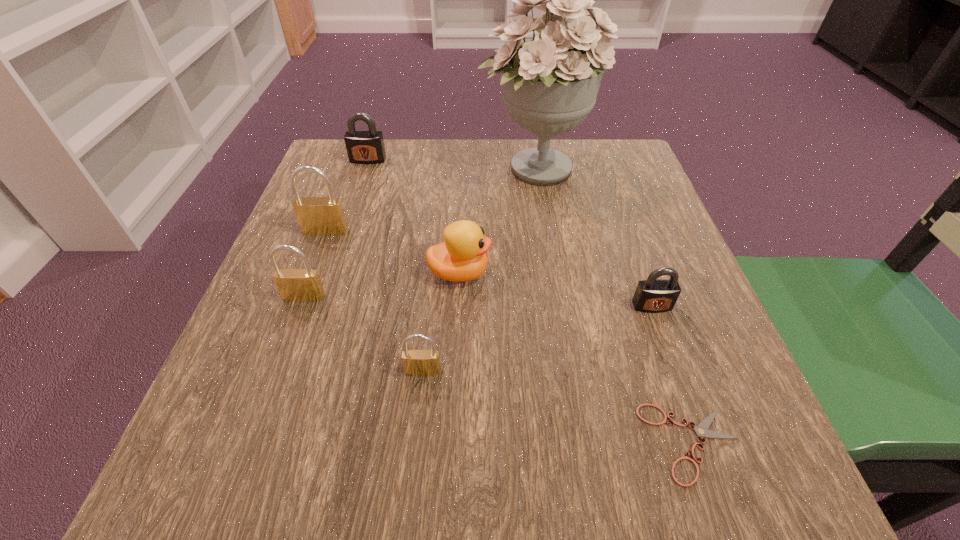
You are a GUI agent. You are given a task and a screenshot of the screen. Output one action in this format:
    pyautogui.click(x=<x>, y=<y>)
    Task: Click on the rightmost padlock
    
    Given the screenshot: What is the action you would take?
    pyautogui.click(x=653, y=295)

The image size is (960, 540). I want to click on the fourth padlock from left to right, so click(x=416, y=362).

Locate an element on the screen. the nearest brass padlock is located at coordinates (416, 362).

The image size is (960, 540). Find the location of `shears`. shears is located at coordinates (701, 430).

Where is `the shortest object`? The height and width of the screenshot is (540, 960). the shortest object is located at coordinates (701, 430).

At what (x,y) coordinates should I click in order to perform the action: click on free space located on the front of the bouquet. Please return your answer as a coordinate pair (x, y). This screenshot has height=540, width=960. Looking at the image, I should click on (554, 298).

The image size is (960, 540). Identify the location of free space located 0.320m on the front-facing side of the sixth nearest object. (271, 376).

The width and height of the screenshot is (960, 540). In order to click on free spot located on the front of the farther gray padlock near the keyhole in this screenshot , I will do `click(354, 202)`.

Where is `vacant space situated 0.300m on the front-facing side of the second nearest brass padlock`? The image size is (960, 540). vacant space situated 0.300m on the front-facing side of the second nearest brass padlock is located at coordinates (235, 485).

Image resolution: width=960 pixels, height=540 pixels. I want to click on free space located 0.110m on the face of the yellow duckling, so click(551, 273).